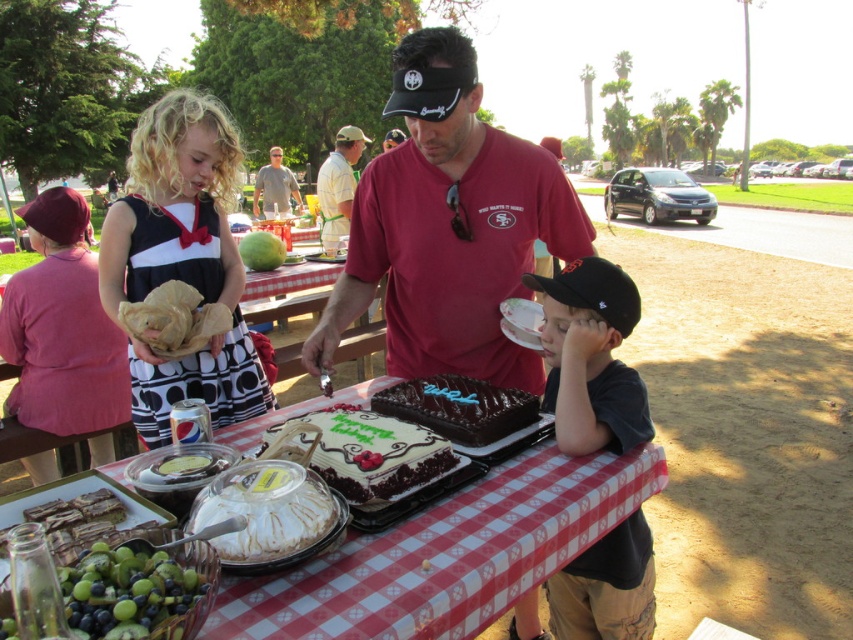
Is black cotton shirt at lower right above chocolate frosted cake at center?

Incorrect, black cotton shirt at lower right is not positioned above chocolate frosted cake at center.

Between point (579, 275) and point (344, 468), which one is positioned behind?

The point (579, 275) is behind.

This screenshot has height=640, width=853. Identify the location of black cotton shirt at lower right. (590, 358).

Does matte black dress at left have a lesser width compared to chocolate frosted cake at center?

Correct, matte black dress at left's width is less than chocolate frosted cake at center's.

How much distance is there between matte black dress at left and chocolate frosted cake at center?

A distance of 1.04 meters exists between matte black dress at left and chocolate frosted cake at center.

The width and height of the screenshot is (853, 640). What do you see at coordinates (183, 260) in the screenshot?
I see `matte black dress at left` at bounding box center [183, 260].

Where is `matte black dress at left`? The image size is (853, 640). matte black dress at left is located at coordinates (183, 260).

Who is more forward, [419,348] or [281,189]?

Point [419,348] is more forward.

Between point (322, 332) and point (274, 198), which one is positioned behind?

The point (274, 198) is behind.

The image size is (853, 640). What do you see at coordinates (450, 227) in the screenshot? I see `smooth chocolate cake at center` at bounding box center [450, 227].

The image size is (853, 640). I want to click on smooth chocolate cake at center, so click(x=450, y=227).